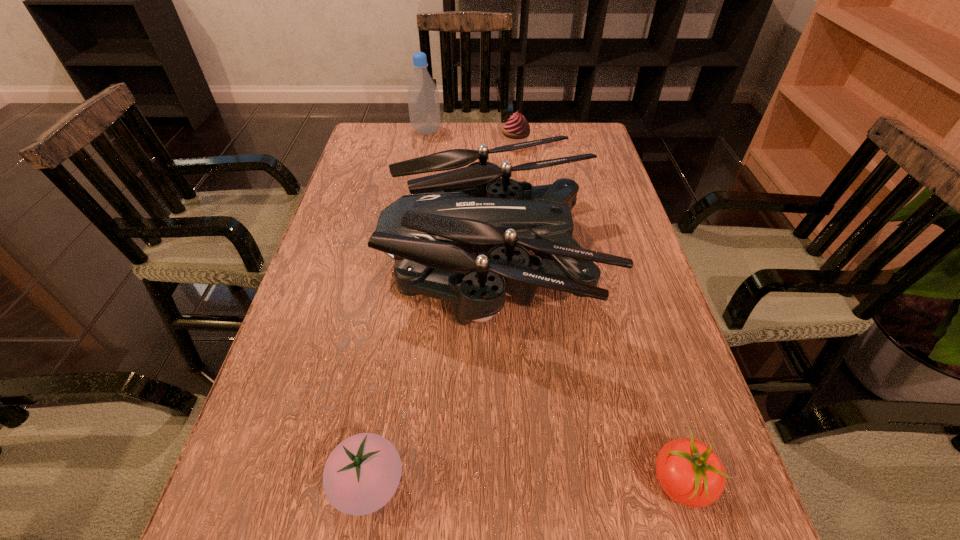
Identify the location of vacant point located between the drone and the right tomato. (586, 370).

Identify which object is the nearest to the left tomato. Please provide its 2D coordinates. Your answer should be formatted as a tuple, i.e. [(x, y)], where the tuple contains the x and y coordinates of a point satisfying the conditions above.

[(449, 215)]

Locate an element on the screen. This screenshot has width=960, height=540. the second closest object to the right tomato is located at coordinates tap(361, 475).

I want to click on free spot that satisfies the following two spatial constraints: 1. on the back side of the drone; 2. on the right side of the cupcake, so coord(489,146).

At what (x,y) coordinates should I click in order to perform the action: click on vacant space that satisfies the following two spatial constraints: 1. on the front side of the cupcake; 2. on the left side of the bottle. Please return your answer as a coordinate pair (x, y). The image size is (960, 540). Looking at the image, I should click on (423, 146).

The image size is (960, 540). What are the coordinates of `vacant space that satisfies the following two spatial constraints: 1. on the front side of the second tallest object; 2. on the left side of the right tomato` in the screenshot? It's located at (496, 482).

Find the location of a particular element. free space that satisfies the following two spatial constraints: 1. on the front side of the second tallest object; 2. on the left side of the right tomato is located at coordinates (496, 482).